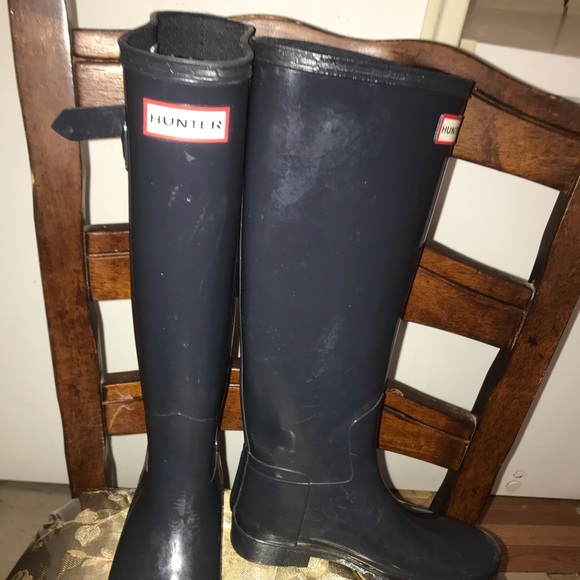
I want to click on chair cushion, so click(x=106, y=529).